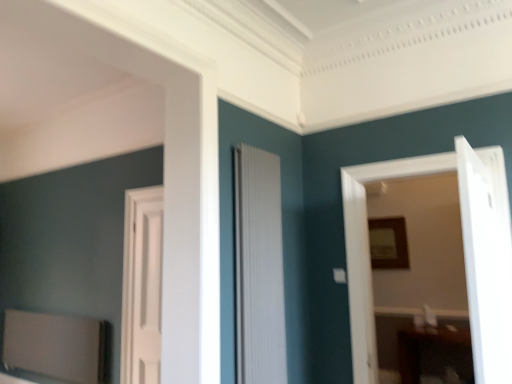
Question: Can you confirm if white glossy door at right, arranged as the fourth door when viewed from the left, is positioned to the left of white matte door at center, the 4th door positioned from the right?

Choices:
 (A) yes
 (B) no

Answer: (B)

Question: Is white glossy door at right, arranged as the fourth door when viewed from the left, further to the viewer compared to white matte door at center, the first door in the left-to-right sequence?

Choices:
 (A) no
 (B) yes

Answer: (A)

Question: Can you confirm if white glossy door at right, arranged as the fourth door when viewed from the left, is wider than white matte door at center, the first door in the left-to-right sequence?

Choices:
 (A) yes
 (B) no

Answer: (B)

Question: Is white glossy door at right, arranged as the fourth door when viewed from the left, aimed at white matte door at center, the 4th door positioned from the right?

Choices:
 (A) no
 (B) yes

Answer: (B)

Question: Is white glossy door at right, arranged as the fourth door when viewed from the left, oriented away from white matte door at center, the 4th door positioned from the right?

Choices:
 (A) no
 (B) yes

Answer: (A)

Question: Considering their positions, is white matte door at center, the first door in the left-to-right sequence, located in front of or behind white wooden door at center, which is counted as the second door, starting from the right?

Choices:
 (A) front
 (B) behind

Answer: (B)

Question: Is point (158, 206) positioned closer to the camera than point (368, 311)?

Choices:
 (A) farther
 (B) closer

Answer: (A)

Question: Considering the positions of white matte door at center, the first door in the left-to-right sequence, and white wooden door at center, which is the 3th door in left-to-right order, in the image, is white matte door at center, the first door in the left-to-right sequence, wider or thinner than white wooden door at center, which is the 3th door in left-to-right order,?

Choices:
 (A) thin
 (B) wide

Answer: (A)

Question: In terms of height, does white matte door at center, the 4th door positioned from the right, look taller or shorter compared to white wooden door at center, which is the 3th door in left-to-right order?

Choices:
 (A) tall
 (B) short

Answer: (A)

Question: Relative to wooden frame at upper right, is white glossy door at right, arranged as the fourth door when viewed from the left, in front or behind?

Choices:
 (A) behind
 (B) front

Answer: (B)

Question: Which is correct: white glossy door at right, arranged as the fourth door when viewed from the left, is inside wooden frame at upper right, or outside of it?

Choices:
 (A) inside
 (B) outside

Answer: (B)

Question: Is point (460, 215) positioned closer to the camera than point (394, 258)?

Choices:
 (A) farther
 (B) closer

Answer: (B)

Question: From the image's perspective, is white glossy door at right, arranged as the fourth door when viewed from the left, located above or below wooden frame at upper right?

Choices:
 (A) above
 (B) below

Answer: (A)

Question: Is wooden frame at upper right inside or outside of white glossy door at right, marked as the first door in a right-to-left arrangement?

Choices:
 (A) inside
 (B) outside

Answer: (B)

Question: Based on their positions, is wooden frame at upper right located to the left or right of white glossy door at right, marked as the first door in a right-to-left arrangement?

Choices:
 (A) left
 (B) right

Answer: (B)